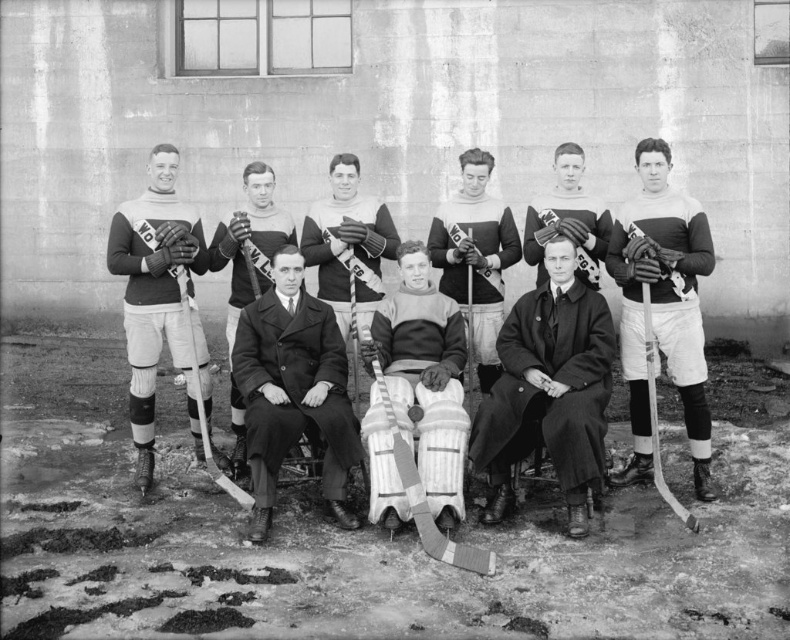
You are a photographer who wants to take a closeup of the smooth black coat at center. Based on the coordinates provided in the description, where should you focus your camera lens?

The smooth black coat at center is located at point (548, 390), so you should focus your camera lens at those coordinates to capture it.

You are a photographer who wants to capture a closeup of the dark brown leather gloves at upper center without including the wooden hockey stick at center in the shot. Is this possible given their positions?

The dark brown leather gloves at upper center are closer to the viewer than the wooden hockey stick at center, so yes, it is possible to focus on the dark brown leather gloves at upper center without including the wooden hockey stick at center in the shot.